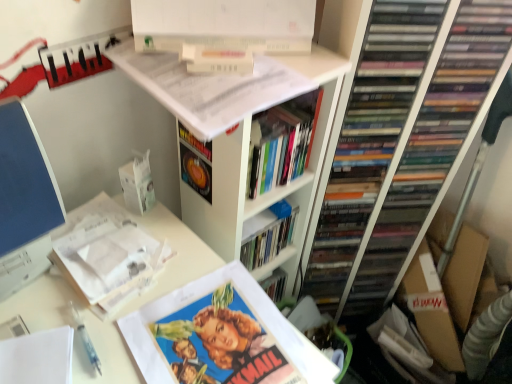
You are a GUI agent. You are given a task and a screenshot of the screen. Output one action in this format:
    pyautogui.click(x=<x>, y=<y>)
    Task: Click on the free space above white paper at upper left (from a real-world perspective)
    This screenshot has width=512, height=384.
    Given the screenshot: What is the action you would take?
    pyautogui.click(x=155, y=315)